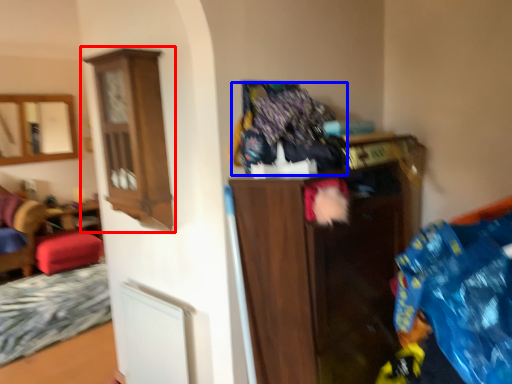
Question: Which object appears farthest to the camera in this image, cabinetry (highlighted by a red box) or laundry (highlighted by a blue box)?

Choices:
 (A) cabinetry
 (B) laundry

Answer: (A)